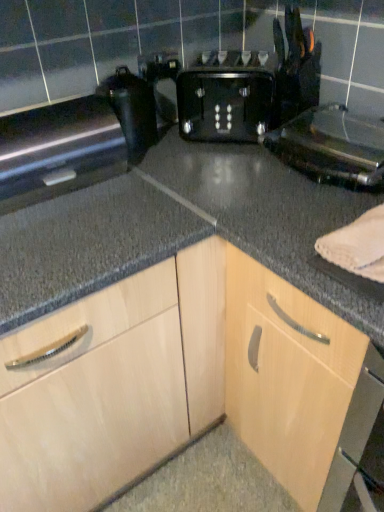
Question: From a real-world perspective, is satin black oven at left, the third appliance from the right, on top of black plastic toaster at center?

Choices:
 (A) no
 (B) yes

Answer: (A)

Question: From the image's perspective, would you say satin black oven at left, the third appliance from the right, is shown under black plastic toaster at center?

Choices:
 (A) no
 (B) yes

Answer: (B)

Question: Considering the relative sizes of satin black oven at left, the 1th appliance viewed from the left, and black plastic toaster at center in the image provided, is satin black oven at left, the 1th appliance viewed from the left, taller than black plastic toaster at center?

Choices:
 (A) no
 (B) yes

Answer: (A)

Question: Can you confirm if satin black oven at left, the 1th appliance viewed from the left, is thinner than black plastic toaster at center?

Choices:
 (A) yes
 (B) no

Answer: (A)

Question: Can you confirm if satin black oven at left, the third appliance from the right, is bigger than black plastic toaster at center?

Choices:
 (A) no
 (B) yes

Answer: (B)

Question: In terms of width, does light wood cabinet at center look wider or thinner when compared to satin black oven at left, the 1th appliance viewed from the left?

Choices:
 (A) wide
 (B) thin

Answer: (A)

Question: Is light wood cabinet at center inside the boundaries of satin black oven at left, the third appliance from the right, or outside?

Choices:
 (A) outside
 (B) inside

Answer: (A)

Question: From a real-world perspective, relative to satin black oven at left, the 1th appliance viewed from the left, is light wood cabinet at center vertically above or below?

Choices:
 (A) below
 (B) above

Answer: (A)

Question: Considering their positions, is light wood cabinet at center located in front of or behind satin black oven at left, the 1th appliance viewed from the left?

Choices:
 (A) behind
 (B) front

Answer: (B)

Question: Is satin black oven at left, the third appliance from the right, inside or outside of black glossy coffee maker at upper left, which appears as the 2th appliance when viewed from the left?

Choices:
 (A) outside
 (B) inside

Answer: (A)

Question: Is point (23, 129) positioned closer to the camera than point (114, 80)?

Choices:
 (A) closer
 (B) farther

Answer: (A)

Question: From the image's perspective, is satin black oven at left, the third appliance from the right, above or below black glossy coffee maker at upper left, which appears as the 2th appliance when viewed from the left?

Choices:
 (A) below
 (B) above

Answer: (A)

Question: In terms of height, does satin black oven at left, the third appliance from the right, look taller or shorter compared to black glossy coffee maker at upper left, which appears as the 2th appliance when viewed from the left?

Choices:
 (A) short
 (B) tall

Answer: (A)

Question: Is black plastic toaster at center inside the boundaries of black glossy coffee maker at upper left, placed as the second appliance when sorted from right to left, or outside?

Choices:
 (A) inside
 (B) outside

Answer: (B)

Question: Based on their positions, is black plastic toaster at center located to the left or right of black glossy coffee maker at upper left, placed as the second appliance when sorted from right to left?

Choices:
 (A) right
 (B) left

Answer: (A)